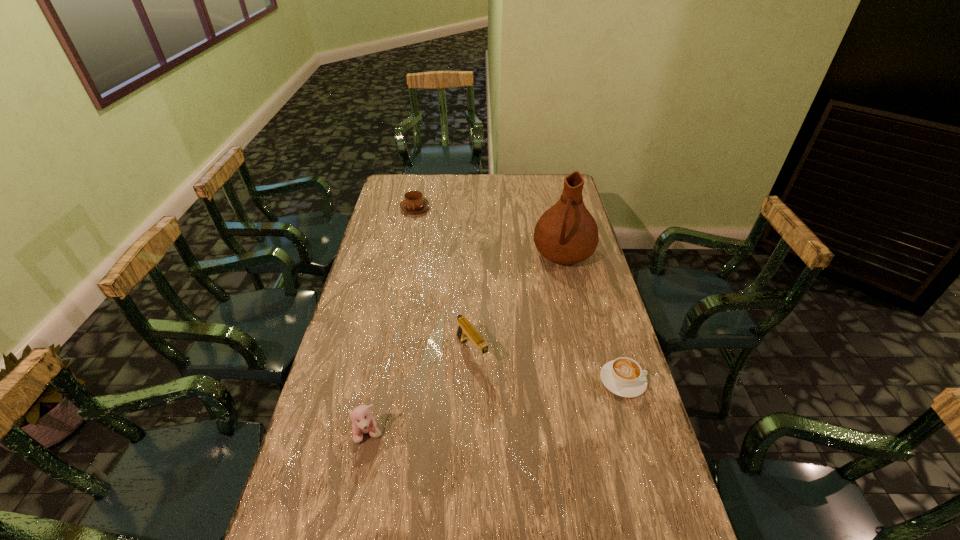
Image resolution: width=960 pixels, height=540 pixels. What are the coordinates of `free space on the desktop that is between the nearest object and the shortest object and is positioned on the side of the second shortest object with the handle` in the screenshot? It's located at (534, 399).

Identify the location of vacant spot on the desktop that is between the teddy bear and the shorter cappuccino and is positioned at the barrel of the pistol. point(513,404).

Locate an element on the screen. The image size is (960, 540). vacant space on the desktop that is between the nearest object and the shortest object and is positioned on the side of the tallest object with the handle is located at coordinates (519, 402).